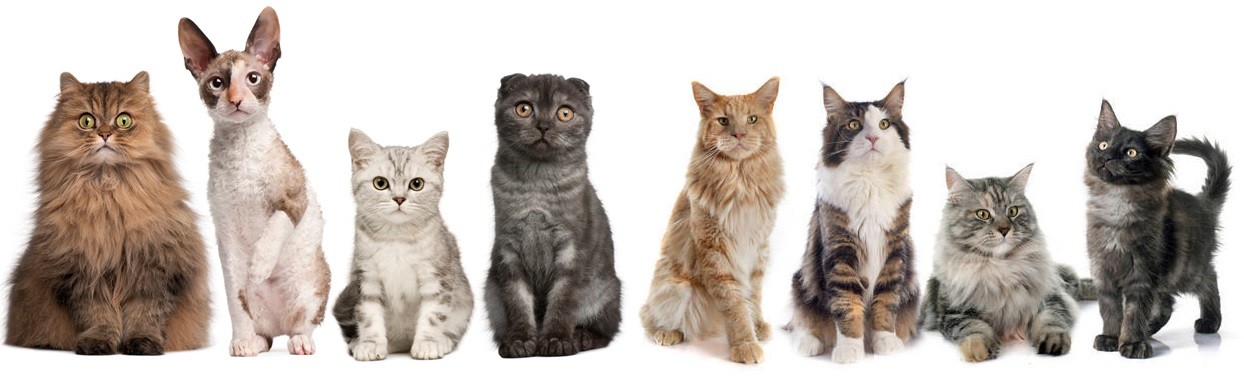
Identify the location of chests. The width and height of the screenshot is (1244, 385). (107, 209), (240, 176), (397, 250), (539, 195), (744, 190), (866, 192), (1001, 292), (1113, 212).